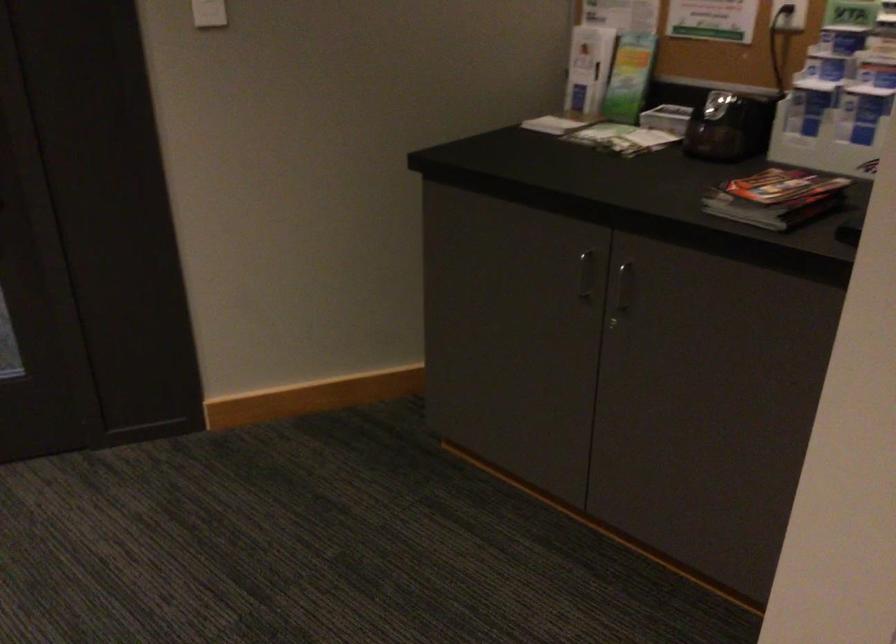
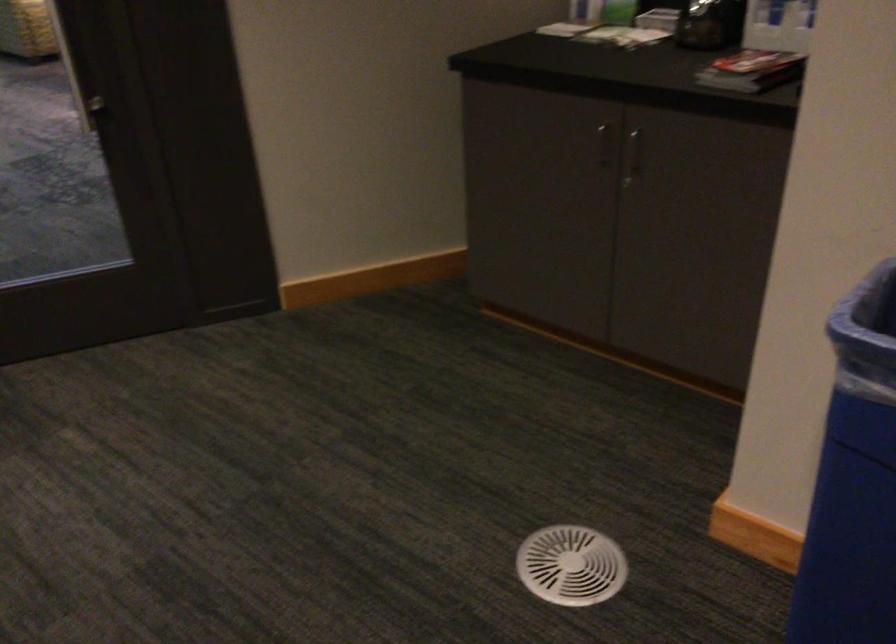
The point at (588,277) is marked in the first image. Where is the corresponding point in the second image?

(604, 144)